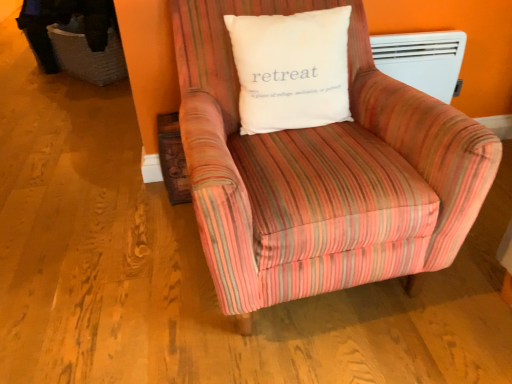
Question: Is striped fabric armchair at center positioned behind white cotton pillow at center?

Choices:
 (A) yes
 (B) no

Answer: (B)

Question: Is striped fabric armchair at center completely or partially outside of white cotton pillow at center?

Choices:
 (A) no
 (B) yes

Answer: (B)

Question: Could you tell me if striped fabric armchair at center is facing white cotton pillow at center?

Choices:
 (A) yes
 (B) no

Answer: (A)

Question: Is striped fabric armchair at center wider than white cotton pillow at center?

Choices:
 (A) no
 (B) yes

Answer: (B)

Question: From a real-world perspective, is striped fabric armchair at center below white cotton pillow at center?

Choices:
 (A) yes
 (B) no

Answer: (A)

Question: Would you say white plastic heater at upper right is to the left or to the right of white cotton pillow at center in the picture?

Choices:
 (A) right
 (B) left

Answer: (A)

Question: From the image's perspective, is white plastic heater at upper right positioned above or below white cotton pillow at center?

Choices:
 (A) above
 (B) below

Answer: (A)

Question: Is white plastic heater at upper right wider or thinner than white cotton pillow at center?

Choices:
 (A) wide
 (B) thin

Answer: (B)

Question: Is point (403, 81) closer or farther from the camera than point (289, 87)?

Choices:
 (A) closer
 (B) farther

Answer: (B)

Question: From their relative heights in the image, would you say striped fabric armchair at center is taller or shorter than white cotton pillow at center?

Choices:
 (A) short
 (B) tall

Answer: (B)

Question: In terms of width, does striped fabric armchair at center look wider or thinner when compared to white cotton pillow at center?

Choices:
 (A) wide
 (B) thin

Answer: (A)

Question: Considering the positions of point (423, 109) and point (334, 112), is point (423, 109) closer or farther from the camera than point (334, 112)?

Choices:
 (A) closer
 (B) farther

Answer: (A)

Question: Is striped fabric armchair at center inside the boundaries of white cotton pillow at center, or outside?

Choices:
 (A) inside
 (B) outside

Answer: (B)

Question: In terms of width, does striped fabric armchair at center look wider or thinner when compared to white plastic heater at upper right?

Choices:
 (A) wide
 (B) thin

Answer: (A)

Question: From the image's perspective, relative to white plastic heater at upper right, is striped fabric armchair at center above or below?

Choices:
 (A) above
 (B) below

Answer: (B)